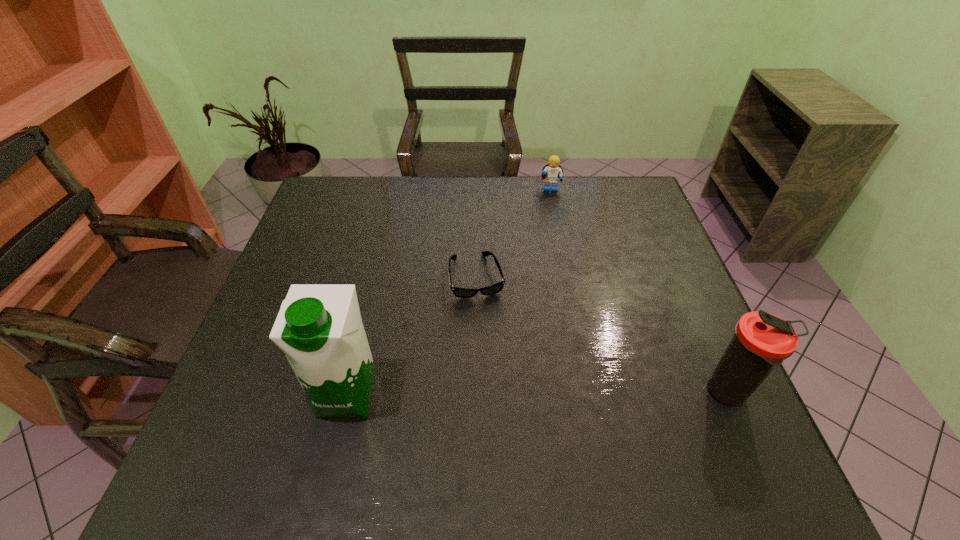
Image resolution: width=960 pixels, height=540 pixels. I want to click on vacant region at the far edge of the desktop, so click(x=414, y=177).

The width and height of the screenshot is (960, 540). In the image, there is a desktop. Find the location of `vacant region at the near edge`. vacant region at the near edge is located at coordinates (549, 405).

Identify the location of free space at the left edge. The width and height of the screenshot is (960, 540). (304, 233).

Find the location of a particular element. The width and height of the screenshot is (960, 540). vacant space at the far left corner of the desktop is located at coordinates (361, 208).

The height and width of the screenshot is (540, 960). I want to click on vacant space at the far right corner of the desktop, so click(646, 201).

The height and width of the screenshot is (540, 960). Identify the location of free spot between the tallest object and the farthest object. (449, 292).

This screenshot has height=540, width=960. Identify the location of empty location between the tallest object and the second tallest object. (538, 394).

Locate an element on the screen. This screenshot has height=540, width=960. vacant space in between the third tallest object and the second object from left to right is located at coordinates [x=514, y=233].

Where is `vacant area between the thermos bottle and the soya milk`? This screenshot has width=960, height=540. vacant area between the thermos bottle and the soya milk is located at coordinates (538, 394).

Where is `empty location between the third nearest object and the thermos bottle`? empty location between the third nearest object and the thermos bottle is located at coordinates (603, 335).